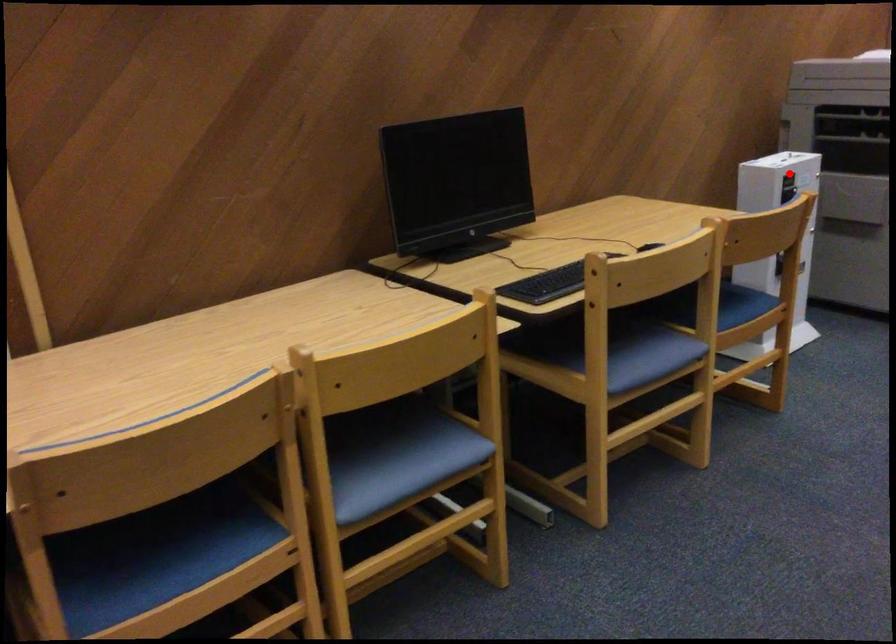
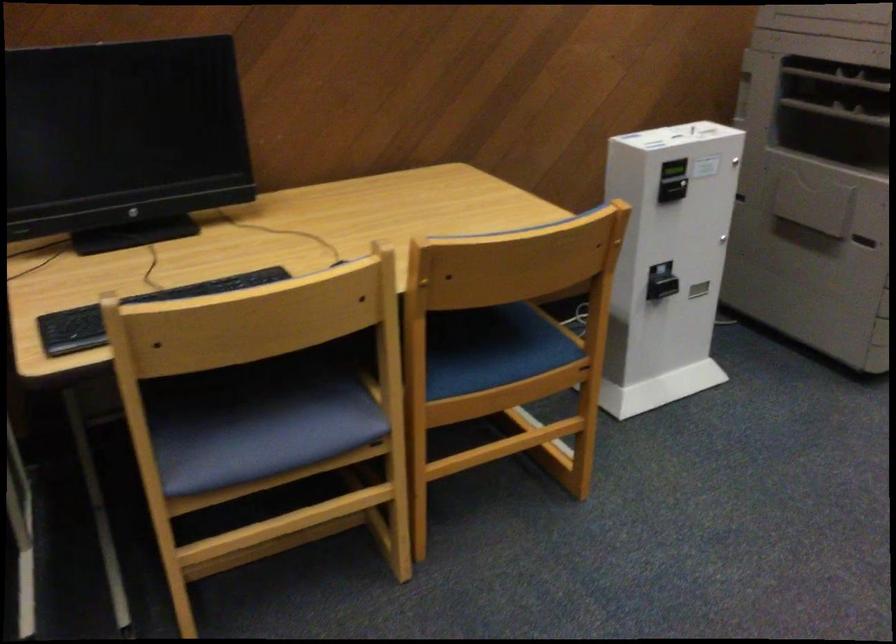
Question: I am providing you with two images of the same scene from different viewpoints. A red point is shown in image1. For the corresponding object point in image2, is it positioned nearer or farther from the camera?

Choices:
 (A) Nearer
 (B) Farther

Answer: (A)